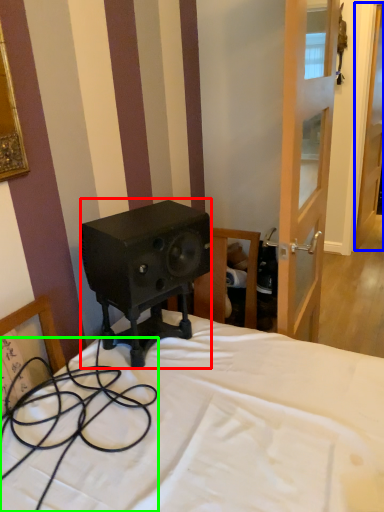
Question: Considering the real-world distances, which object is farthest from loudspeaker (highlighted by a red box)? door (highlighted by a blue box) or cable (highlighted by a green box)?

Choices:
 (A) door
 (B) cable

Answer: (A)